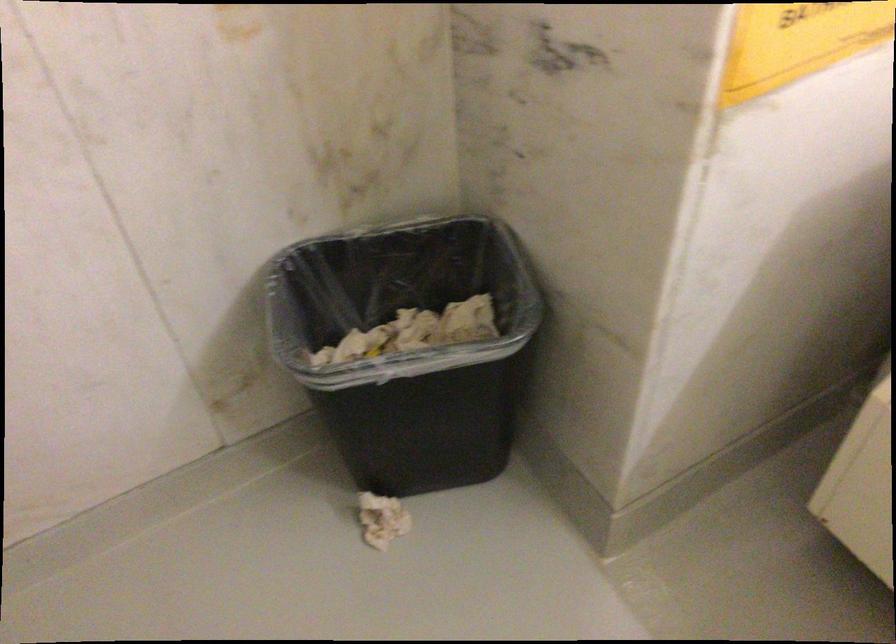
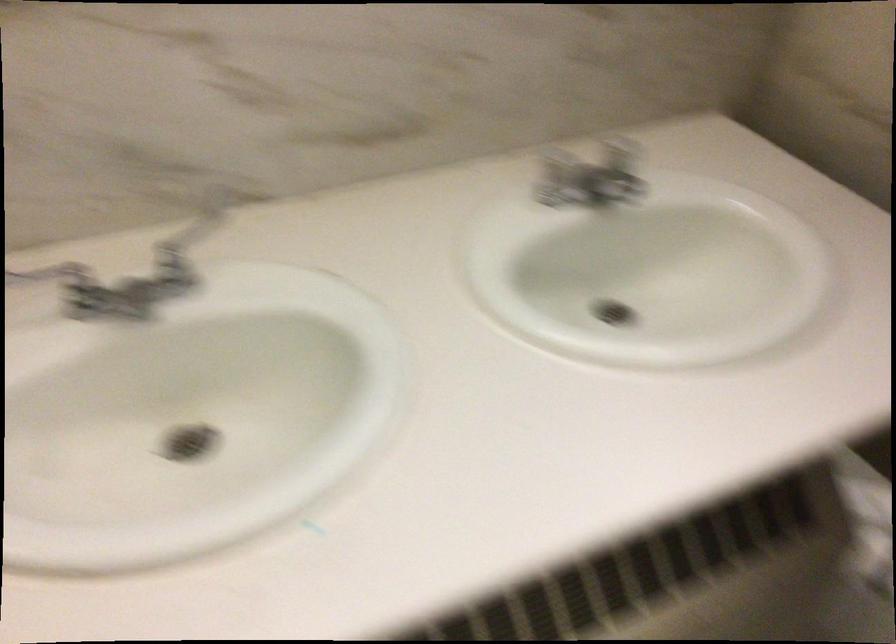
In the scene shown: The first image is from the beginning of the video and the second image is from the end. How did the camera likely rotate when shooting the video?

The rotation direction of the camera is right-down.